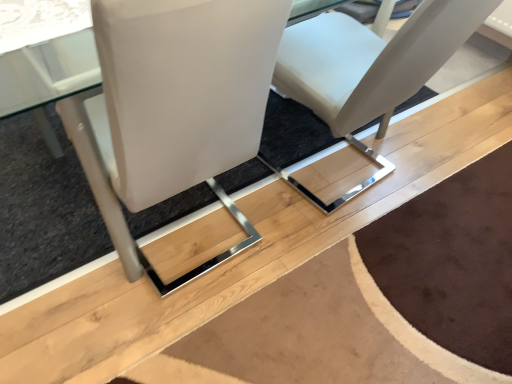
Question: From the image's perspective, is white leather chair at center, arranged as the 1th chair when viewed from the right, above or below white leather chair at center, the 2th chair in the right-to-left sequence?

Choices:
 (A) above
 (B) below

Answer: (A)

Question: Which is correct: white leather chair at center, arranged as the 1th chair when viewed from the right, is inside white leather chair at center, which is the 1th chair from left to right, or outside of it?

Choices:
 (A) inside
 (B) outside

Answer: (B)

Question: From their relative heights in the image, would you say white leather chair at center, the second chair positioned from the left, is taller or shorter than white leather chair at center, the 2th chair in the right-to-left sequence?

Choices:
 (A) short
 (B) tall

Answer: (A)

Question: Is white leather chair at center, the 2th chair in the right-to-left sequence, bigger or smaller than white leather chair at center, the second chair positioned from the left?

Choices:
 (A) big
 (B) small

Answer: (B)

Question: Is white leather chair at center, which is the 1th chair from left to right, taller or shorter than white leather chair at center, arranged as the 1th chair when viewed from the right?

Choices:
 (A) short
 (B) tall

Answer: (B)

Question: From a real-world perspective, is white leather chair at center, the 2th chair in the right-to-left sequence, positioned above or below white leather chair at center, arranged as the 1th chair when viewed from the right?

Choices:
 (A) below
 (B) above

Answer: (B)

Question: Is white leather chair at center, which is the 1th chair from left to right, in front of or behind white leather chair at center, arranged as the 1th chair when viewed from the right, in the image?

Choices:
 (A) behind
 (B) front

Answer: (B)